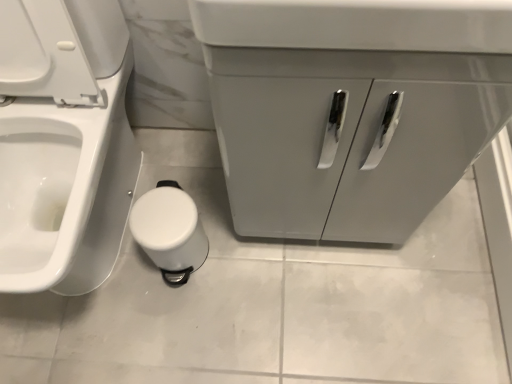
Locate an element on the screen. This screenshot has width=512, height=384. free spot behind white plastic toilet paper at lower center is located at coordinates (187, 185).